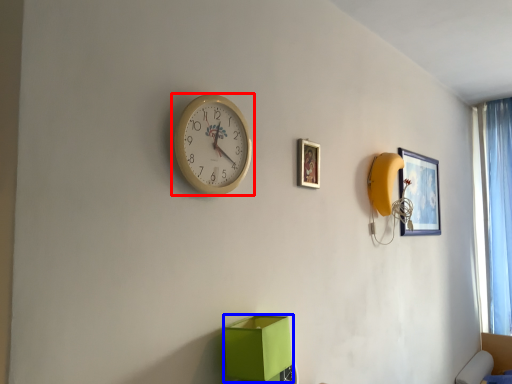
Question: Which of the following is the closest to the observer, wall clock (highlighted by a red box) or cardboard box (highlighted by a blue box)?

Choices:
 (A) wall clock
 (B) cardboard box

Answer: (A)